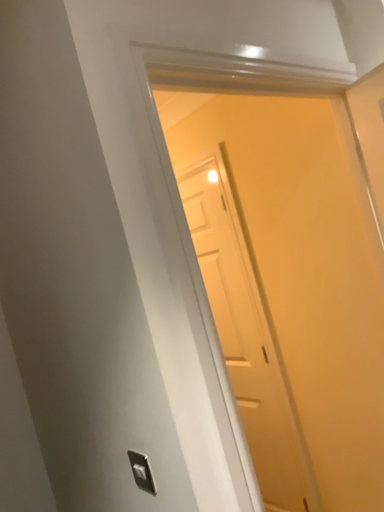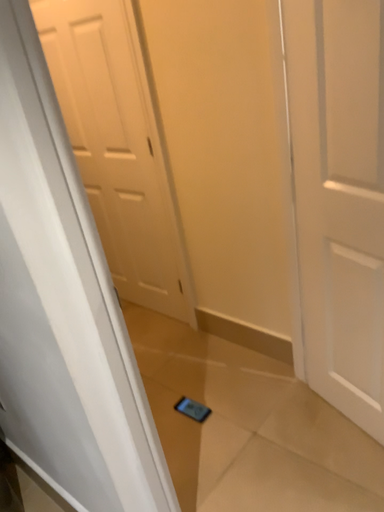
Question: How did the camera likely rotate when shooting the video?

Choices:
 (A) rotated downward
 (B) rotated upward

Answer: (A)